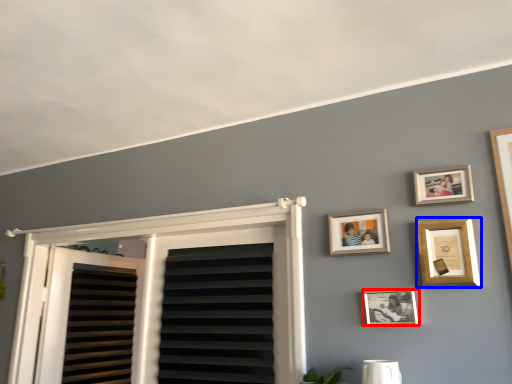
Question: Which object appears closest to the camera in this image, picture frame (highlighted by a red box) or picture frame (highlighted by a blue box)?

Choices:
 (A) picture frame
 (B) picture frame

Answer: (B)